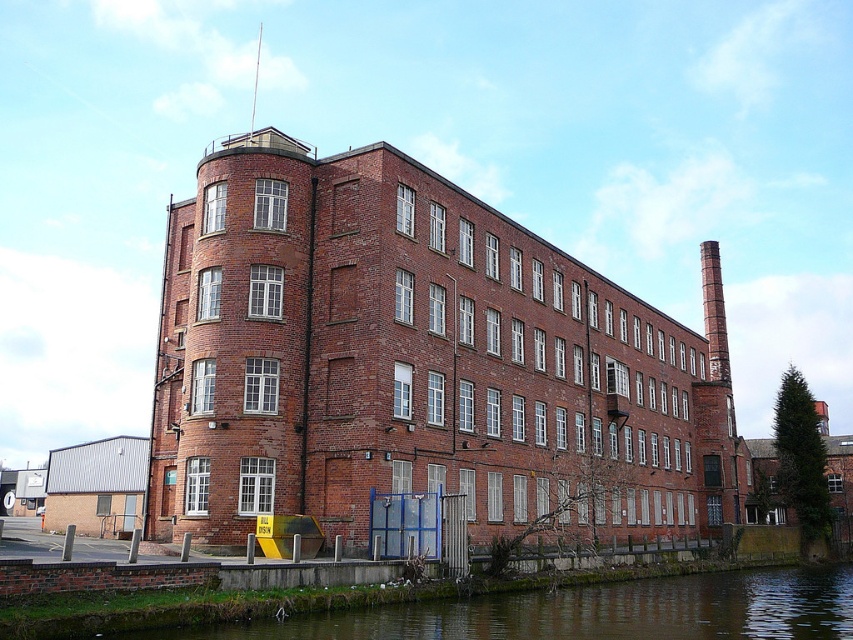
Is the position of green mossy stone at lower left less distant than that of red brick chimney at right?

That is True.

Between green mossy stone at lower left and red brick chimney at right, which one appears on the left side from the viewer's perspective?

green mossy stone at lower left is more to the left.

I want to click on green mossy stone at lower left, so click(590, 611).

Locate an element on the screen. green mossy stone at lower left is located at coordinates (590, 611).